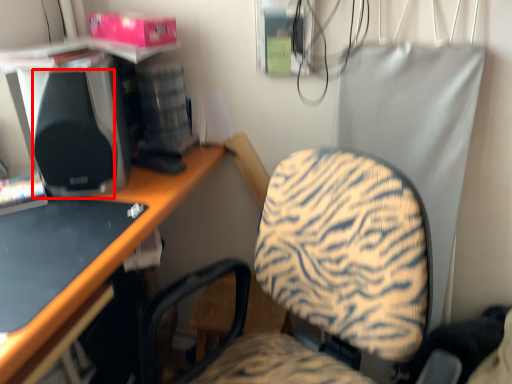
Question: Considering the relative positions of speaker (annotated by the red box) and desktop in the image provided, where is speaker (annotated by the red box) located with respect to the staircase?

Choices:
 (A) left
 (B) right

Answer: (B)